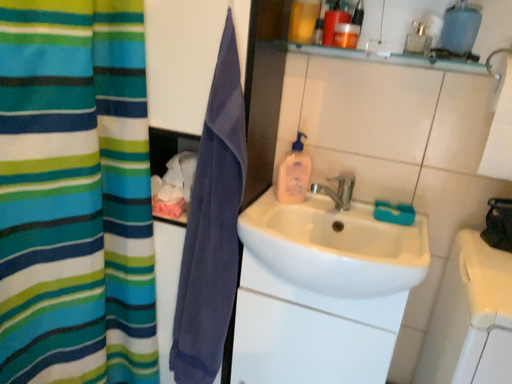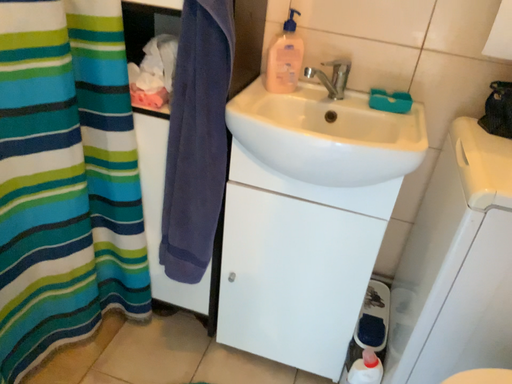
Question: How did the camera likely rotate when shooting the video?

Choices:
 (A) rotated upward
 (B) rotated downward

Answer: (B)